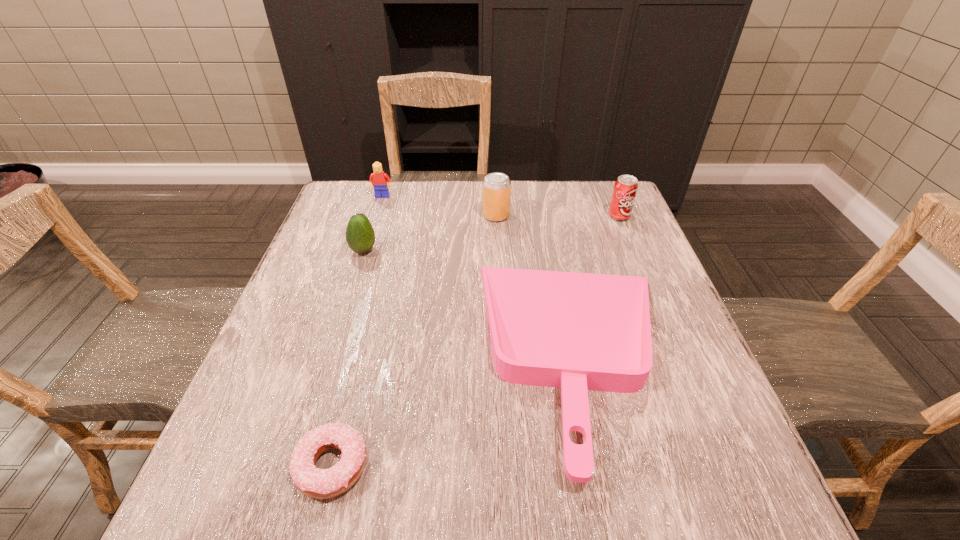
The height and width of the screenshot is (540, 960). In order to click on the left soda in this screenshot , I will do `click(496, 196)`.

Where is `the right soda`? the right soda is located at coordinates (625, 188).

You are a GUI agent. You are given a task and a screenshot of the screen. Output one action in this format:
    pyautogui.click(x=<x>, y=<y>)
    Task: Click on the farthest object
    Image resolution: width=960 pixels, height=540 pixels.
    Given the screenshot: What is the action you would take?
    pyautogui.click(x=378, y=179)

Where is `avocado`? avocado is located at coordinates 360,236.

Locate an element on the screen. The image size is (960, 540). the fifth tallest object is located at coordinates (576, 331).

The width and height of the screenshot is (960, 540). Find the location of `the shortest object`. the shortest object is located at coordinates (316, 483).

You are a GUI agent. You are given a task and a screenshot of the screen. Output one action in this format:
    pyautogui.click(x=<x>, y=<y>)
    Task: Click on the vacant space located 0.400m on the left of the left soda
    
    Given the screenshot: What is the action you would take?
    pyautogui.click(x=341, y=215)

I want to click on free space located on the left of the right soda, so click(x=530, y=217).

Find the location of a particular element. Image resolution: width=960 pixels, height=540 pixels. free space located on the face of the Lego is located at coordinates (354, 289).

In order to click on vacant area situated on the right of the third nearest object in this screenshot , I will do `click(420, 251)`.